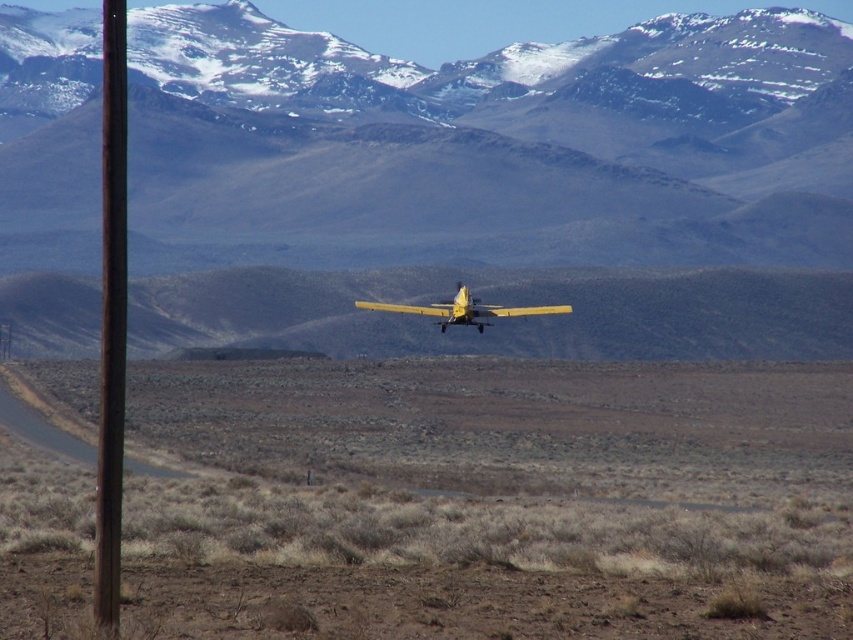
Question: Does snowy rock mountain range at upper center have a larger size compared to yellow matte airplane at center?

Choices:
 (A) no
 (B) yes

Answer: (B)

Question: Which object is positioned farthest from the rusty metal pole at left?

Choices:
 (A) snowy rock mountain range at upper center
 (B) brown dirt at center

Answer: (A)

Question: Based on their relative distances, which object is farther from the snowy rock mountain range at upper center?

Choices:
 (A) rusty metal pole at left
 (B) brown dirt at center
 (C) yellow matte airplane at center

Answer: (A)

Question: Does brown dirt at center have a greater width compared to rusty metal pole at left?

Choices:
 (A) yes
 (B) no

Answer: (A)

Question: Does snowy rock mountain range at upper center have a larger size compared to yellow matte airplane at center?

Choices:
 (A) yes
 (B) no

Answer: (A)

Question: Which point is farther to the camera?

Choices:
 (A) (355, 300)
 (B) (120, 284)

Answer: (A)